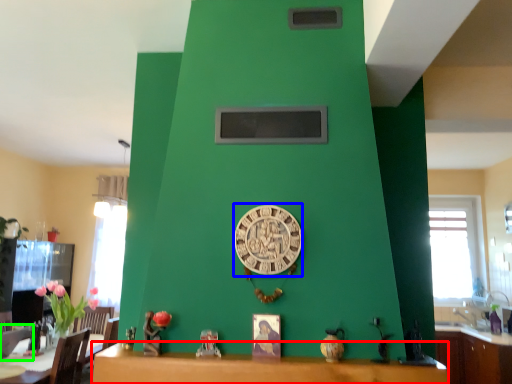
Question: Estimate the real-world distances between objects in this image. Which object is farther from table (highlighted by a red box), clock (highlighted by a blue box) or armchair (highlighted by a green box)?

Choices:
 (A) clock
 (B) armchair

Answer: (B)